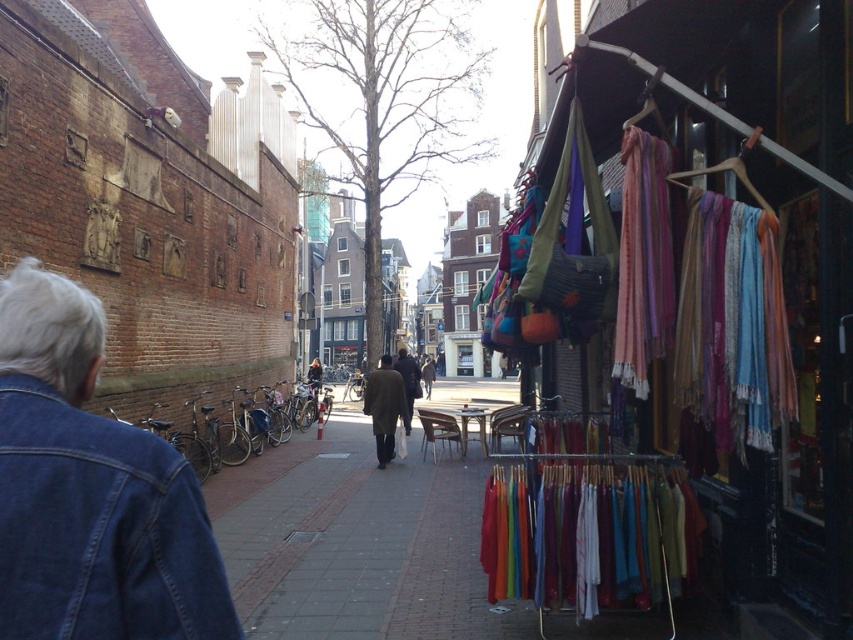
From the picture: You are a delivery person who needs to carry both the textured fabric scarves at right and the dark brown wool coat at center through a narrow alleyway. Which item should you carry first to ensure easier passage?

The textured fabric scarves at right has a lesser width compared to the dark brown wool coat at center, so you should carry the textured fabric scarves at right first to ensure easier passage through the narrow alleyway.

You are standing at the entrance of the shop on the right side of the street. There are two points marked in the image. The first point is at coordinates point (846, 618) and the second is at point (403, 413). If you want to move from the entrance towards the back of the shop, which point would you encounter first?

Point (846, 618) is in front of point (403, 413), so you would encounter point (846, 618) first as you move towards the back of the shop.